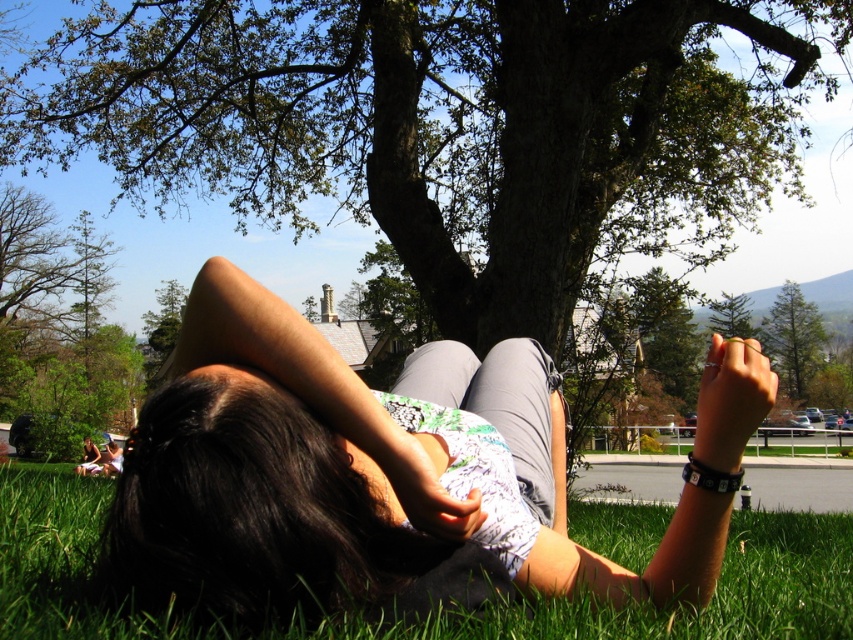
You are standing at the point marked by the coordinates point (686,611) in the image. What is the immediate surface you are standing on?

The immediate surface at point (686,611) is green grass at lower left.

You are planning to place a picnic blanket between the green leafy tree at upper center and the green grass at lower left. The blanket is 3 meters long. Will it fit between them without overlapping either?

The distance between the green leafy tree at upper center and the green grass at lower left is 6.32 meters. Since the blanket is only 3 meters long, it will fit comfortably between them without overlapping either.

You are planning to set up a small tent in the area shown in the image. Considering the green leafy tree at upper center and the green grass at lower left, which location would provide more space for the tent?

The green grass at lower left would provide more space for the tent since it has a greater width than the green leafy tree at upper center.